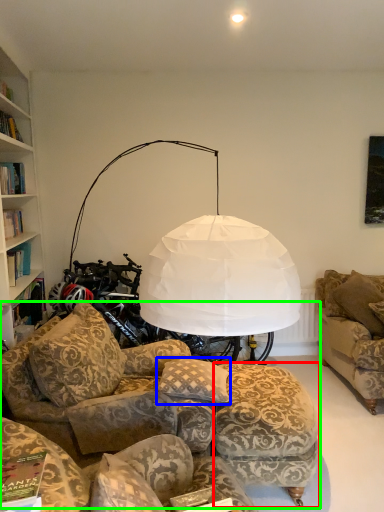
Question: Based on their relative distances, which object is farther from stool (highlighted by a red box)? Choose from pillow (highlighted by a blue box) and studio couch (highlighted by a green box).

Choices:
 (A) pillow
 (B) studio couch

Answer: (A)